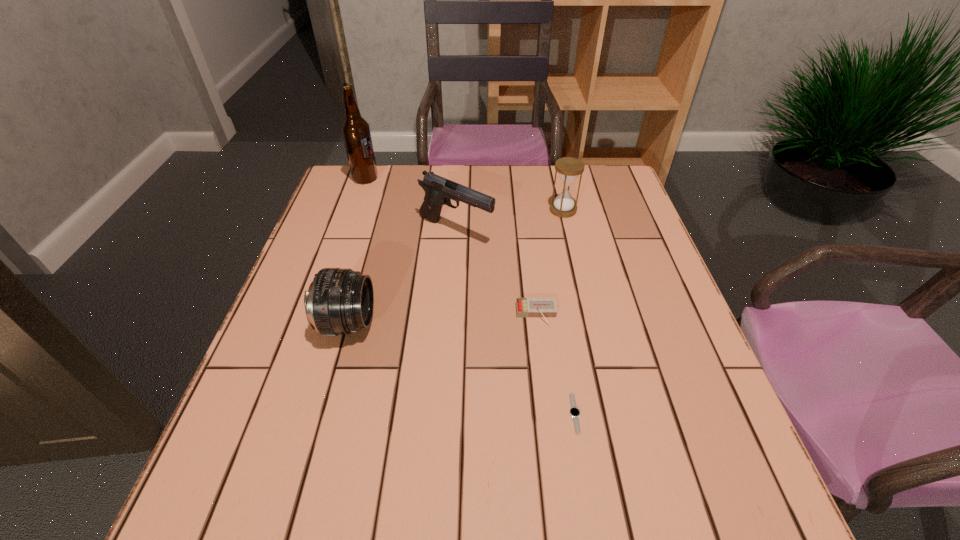
In the image, there is a desktop. Where is `free space at the left edge`? This screenshot has width=960, height=540. free space at the left edge is located at coordinates (310, 387).

Where is `free space at the right edge`? The image size is (960, 540). free space at the right edge is located at coordinates tap(609, 248).

Locate an element on the screen. vacant space at the far left corner is located at coordinates (338, 179).

Locate an element on the screen. vacant area at the near left corner of the desktop is located at coordinates (229, 519).

The width and height of the screenshot is (960, 540). Find the location of `free spot between the telephoto lens and the tallest object`. free spot between the telephoto lens and the tallest object is located at coordinates (357, 251).

Where is `free point between the gun and the matchbox`? The width and height of the screenshot is (960, 540). free point between the gun and the matchbox is located at coordinates (496, 273).

In order to click on vacant space that is in between the matchbox and the watch in this screenshot , I will do `click(556, 364)`.

The height and width of the screenshot is (540, 960). I want to click on free space between the telephoto lens and the rightmost object, so click(455, 267).

Where is `free space between the shortest object and the matchbox`? The image size is (960, 540). free space between the shortest object and the matchbox is located at coordinates (556, 364).

I want to click on free space that is in between the shortest object and the fifth tallest object, so click(556, 364).